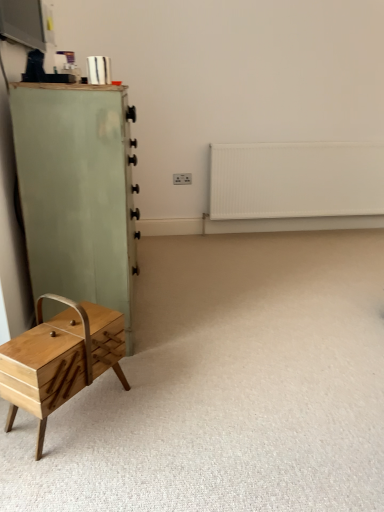
Question: Would you consider natural wood drawer at lower left to be distant from wooden sewing box at lower left?

Choices:
 (A) yes
 (B) no

Answer: (B)

Question: Is natural wood drawer at lower left smaller than wooden sewing box at lower left?

Choices:
 (A) yes
 (B) no

Answer: (A)

Question: Is natural wood drawer at lower left shorter than wooden sewing box at lower left?

Choices:
 (A) no
 (B) yes

Answer: (A)

Question: Is the position of natural wood drawer at lower left more distant than that of wooden sewing box at lower left?

Choices:
 (A) yes
 (B) no

Answer: (A)

Question: Considering the relative sizes of natural wood drawer at lower left and wooden sewing box at lower left in the image provided, is natural wood drawer at lower left thinner than wooden sewing box at lower left?

Choices:
 (A) yes
 (B) no

Answer: (A)

Question: Is wooden sewing box at lower left taller or shorter than light green wood chest of drawers at left?

Choices:
 (A) short
 (B) tall

Answer: (A)

Question: From the image's perspective, is wooden sewing box at lower left above or below light green wood chest of drawers at left?

Choices:
 (A) below
 (B) above

Answer: (A)

Question: In terms of width, does wooden sewing box at lower left look wider or thinner when compared to light green wood chest of drawers at left?

Choices:
 (A) thin
 (B) wide

Answer: (B)

Question: Looking at the image, does wooden sewing box at lower left seem bigger or smaller compared to light green wood chest of drawers at left?

Choices:
 (A) small
 (B) big

Answer: (A)

Question: In the image, is white matte radiator at upper right on the left side or the right side of natural wood drawer at lower left?

Choices:
 (A) left
 (B) right

Answer: (B)

Question: In the image, is white matte radiator at upper right positioned in front of or behind natural wood drawer at lower left?

Choices:
 (A) front
 (B) behind

Answer: (B)

Question: Looking at the image, does white matte radiator at upper right seem bigger or smaller compared to natural wood drawer at lower left?

Choices:
 (A) big
 (B) small

Answer: (A)

Question: Is point (301, 160) positioned closer to the camera than point (64, 326)?

Choices:
 (A) closer
 (B) farther

Answer: (B)

Question: Relative to white matte radiator at upper right, is light green wood chest of drawers at left in front or behind?

Choices:
 (A) behind
 (B) front

Answer: (B)

Question: From a real-world perspective, relative to white matte radiator at upper right, is light green wood chest of drawers at left vertically above or below?

Choices:
 (A) above
 (B) below

Answer: (A)